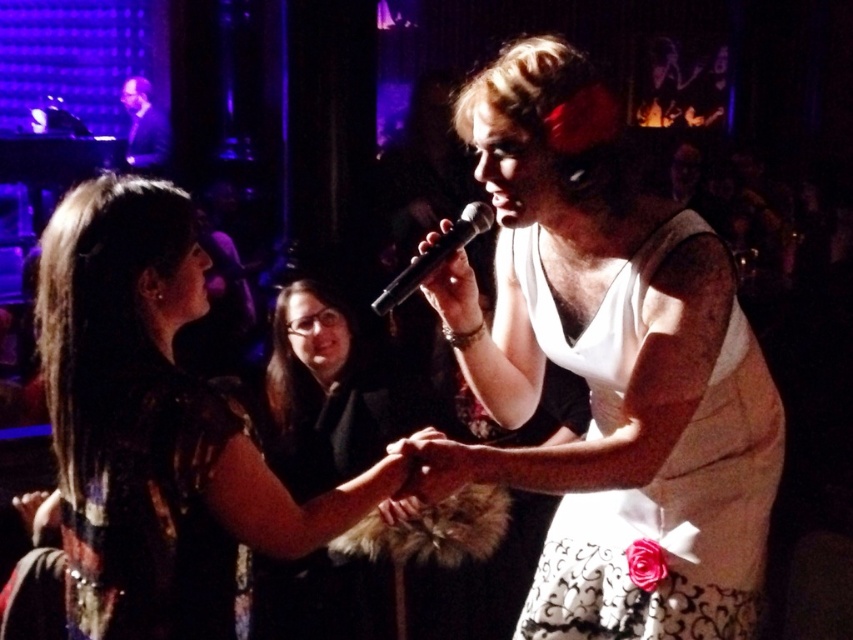
Can you confirm if white lace dress at center is taller than dark suit at upper left?

Indeed, white lace dress at center has a greater height compared to dark suit at upper left.

Between white lace dress at center and dark suit at upper left, which one has more height?

Standing taller between the two is white lace dress at center.

At what (x,y) coordinates should I click in order to perform the action: click on white lace dress at center. Please return your answer as a coordinate pair (x, y). This screenshot has width=853, height=640. Looking at the image, I should click on (672, 522).

Is point (730, 509) in front of point (157, 637)?

No, (730, 509) is behind (157, 637).

Which is above, white lace dress at center or shiny sequined dress at lower left?

white lace dress at center

Find the location of a particular element. The height and width of the screenshot is (640, 853). white lace dress at center is located at coordinates (672, 522).

Can you confirm if black sequined dress at center is shorter than black matte dress at center?

No, black sequined dress at center is not shorter than black matte dress at center.

Can you confirm if black sequined dress at center is thinner than black matte dress at center?

In fact, black sequined dress at center might be wider than black matte dress at center.

Describe the element at coordinates (155, 428) in the screenshot. I see `black sequined dress at center` at that location.

Where is `black sequined dress at center`? black sequined dress at center is located at coordinates (155, 428).